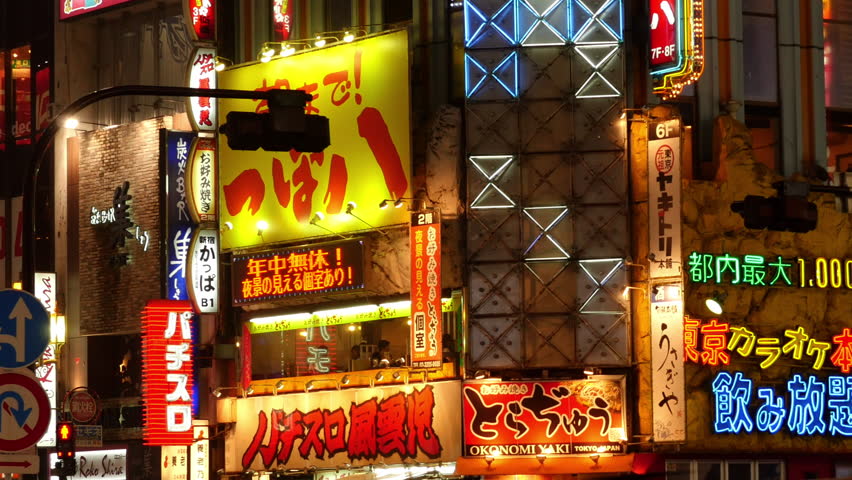
The width and height of the screenshot is (852, 480). Find the location of `yellow neon light chinese character`. yellow neon light chinese character is located at coordinates (745, 337), (757, 350), (796, 345), (820, 352).